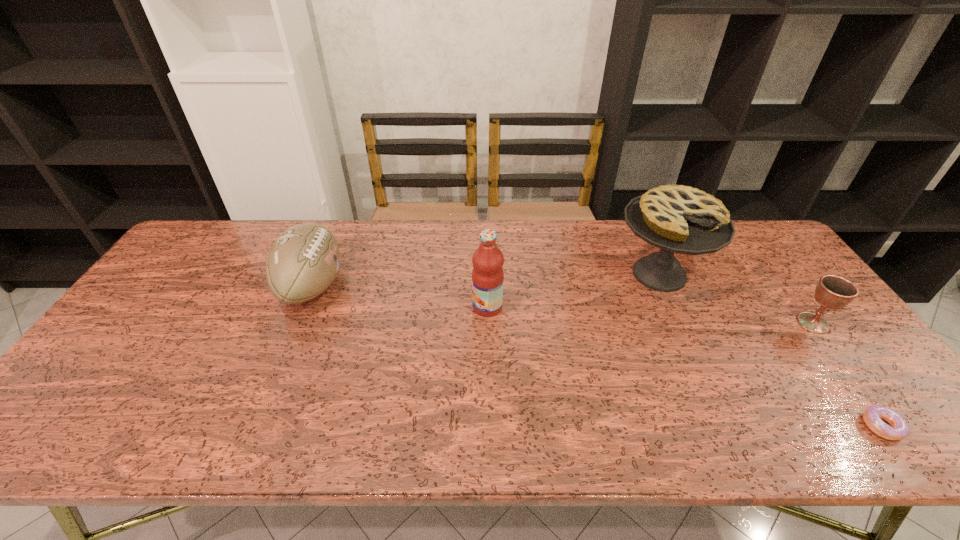
Identify the location of free space in the image that satisfies the following two spatial constraints: 1. on the front label of the second object from left to right; 2. on the left side of the shortest object. The width and height of the screenshot is (960, 540). (490, 426).

You are a GUI agent. You are given a task and a screenshot of the screen. Output one action in this format:
    pyautogui.click(x=<x>, y=<y>)
    Task: Click on the vacant area in the image that satisfies the following two spatial constraints: 1. on the cut side of the pie; 2. on the front label of the second object from left to right
    
    Given the screenshot: What is the action you would take?
    pyautogui.click(x=674, y=307)

Find the location of a particular element. Image resolution: width=960 pixels, height=540 pixels. blank space that satisfies the following two spatial constraints: 1. on the laces of the third tallest object; 2. on the left side of the fourth tallest object is located at coordinates (298, 323).

Where is `vacant space that satisfies the following two spatial constraints: 1. on the laces of the doughnut; 2. on the left side of the leftmost object`? This screenshot has width=960, height=540. vacant space that satisfies the following two spatial constraints: 1. on the laces of the doughnut; 2. on the left side of the leftmost object is located at coordinates (254, 426).

I want to click on vacant position in the image that satisfies the following two spatial constraints: 1. on the laces of the football (American); 2. on the right side of the nearest object, so click(254, 426).

Where is `vacant point that satisfies the following two spatial constraints: 1. on the cut side of the pie; 2. on the front label of the fruit juice`? This screenshot has height=540, width=960. vacant point that satisfies the following two spatial constraints: 1. on the cut side of the pie; 2. on the front label of the fruit juice is located at coordinates (674, 307).

The width and height of the screenshot is (960, 540). Identify the location of free spot that satisfies the following two spatial constraints: 1. on the back side of the doughnut; 2. on the front label of the fruit juice. (794, 307).

Locate an element on the screen. Image resolution: width=960 pixels, height=540 pixels. free space that satisfies the following two spatial constraints: 1. on the laces of the third shortest object; 2. on the right side of the chalice is located at coordinates (298, 323).